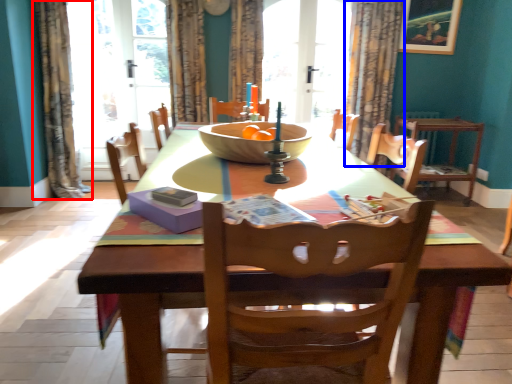
Question: Which point is closer to the camera, curtain (highlighted by a red box) or curtain (highlighted by a blue box)?

Choices:
 (A) curtain
 (B) curtain

Answer: (A)